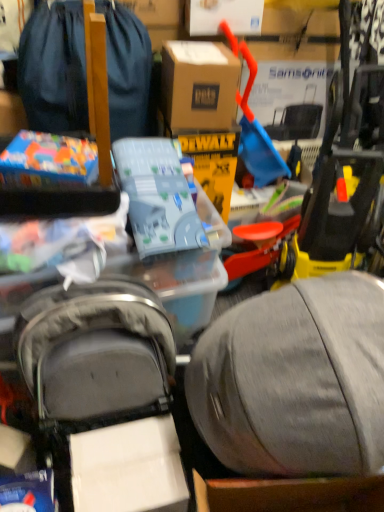
The image size is (384, 512). In order to click on matte black backpack at upper left in this screenshot , I will do `click(54, 68)`.

What do you see at coordinates (198, 85) in the screenshot? I see `brown cardboard box at center` at bounding box center [198, 85].

You are a GUI agent. You are given a task and a screenshot of the screen. Output one action in this format:
    pyautogui.click(x=<x>, y=<y>)
    Task: Click on the matte black backpack at upper left
    The width and height of the screenshot is (384, 512).
    Given the screenshot: What is the action you would take?
    pyautogui.click(x=54, y=68)

You are a GUI agent. You are given a task and a screenshot of the screen. Output one action in this format:
    pyautogui.click(x=<x>, y=<y>)
    Task: Click on the toy to the right of matte plastic toy at upper left, the second toy from the right
    The width and height of the screenshot is (384, 512).
    Given the screenshot: What is the action you would take?
    pyautogui.click(x=157, y=196)

Which object is further away from the camera taking this photo, matte plastic toy at upper left, marked as the first toy in a left-to-right arrangement, or translucent plastic toy at center, which is the second toy in left-to-right order?

matte plastic toy at upper left, marked as the first toy in a left-to-right arrangement.

From a real-world perspective, is matte plastic toy at upper left, the second toy from the right, on translucent plastic toy at center, which is the second toy in left-to-right order?

Indeed, from a real-world perspective, matte plastic toy at upper left, the second toy from the right, stands above translucent plastic toy at center, which is the second toy in left-to-right order.

From the image's perspective, would you say matte black backpack at upper left is shown under brown cardboard box at center?

No.

Does point (39, 11) appear closer or farther from the camera than point (175, 80)?

Clearly, point (39, 11) is more distant from the camera than point (175, 80).

Is matte black backpack at upper left wider than brown cardboard box at center?

Correct, the width of matte black backpack at upper left exceeds that of brown cardboard box at center.

In the image, is matte black backpack at upper left on the left side or the right side of brown cardboard box at center?

matte black backpack at upper left is to the left of brown cardboard box at center.

Can you confirm if translucent plastic toy at center, which appears as the first toy when viewed from the right, is thinner than brown cardboard box at center?

No, translucent plastic toy at center, which appears as the first toy when viewed from the right, is not thinner than brown cardboard box at center.

Which of these two, translucent plastic toy at center, which appears as the first toy when viewed from the right, or brown cardboard box at center, is bigger?

Bigger between the two is translucent plastic toy at center, which appears as the first toy when viewed from the right.

Can you confirm if translucent plastic toy at center, which appears as the first toy when viewed from the right, is taller than brown cardboard box at center?

Indeed, translucent plastic toy at center, which appears as the first toy when viewed from the right, has a greater height compared to brown cardboard box at center.

Considering their positions, is translucent plastic toy at center, which is the second toy in left-to-right order, located in front of or behind brown cardboard box at center?

In the image, translucent plastic toy at center, which is the second toy in left-to-right order, appears in front of brown cardboard box at center.

Is translucent plastic toy at center, which appears as the first toy when viewed from the right, to the left of matte plastic toy at upper left, marked as the first toy in a left-to-right arrangement, from the viewer's perspective?

Incorrect, translucent plastic toy at center, which appears as the first toy when viewed from the right, is not on the left side of matte plastic toy at upper left, marked as the first toy in a left-to-right arrangement.

Would you consider translucent plastic toy at center, which appears as the first toy when viewed from the right, to be distant from matte plastic toy at upper left, the second toy from the right?

No, translucent plastic toy at center, which appears as the first toy when viewed from the right, is in close proximity to matte plastic toy at upper left, the second toy from the right.

From a real-world perspective, is translucent plastic toy at center, which is the second toy in left-to-right order, located higher than matte plastic toy at upper left, marked as the first toy in a left-to-right arrangement?

Actually, translucent plastic toy at center, which is the second toy in left-to-right order, is physically below matte plastic toy at upper left, marked as the first toy in a left-to-right arrangement, in the real world.

Who is shorter, matte plastic toy at upper left, the second toy from the right, or matte black backpack at upper left?

With less height is matte plastic toy at upper left, the second toy from the right.

From a real-world perspective, which is physically above, matte plastic toy at upper left, marked as the first toy in a left-to-right arrangement, or matte black backpack at upper left?

matte black backpack at upper left, from a real-world perspective.

Considering the relative sizes of matte plastic toy at upper left, the second toy from the right, and matte black backpack at upper left in the image provided, is matte plastic toy at upper left, the second toy from the right, wider than matte black backpack at upper left?

In fact, matte plastic toy at upper left, the second toy from the right, might be narrower than matte black backpack at upper left.

From the image's perspective, would you say matte plastic toy at upper left, marked as the first toy in a left-to-right arrangement, is positioned over matte black backpack at upper left?

Actually, matte plastic toy at upper left, marked as the first toy in a left-to-right arrangement, appears below matte black backpack at upper left in the image.

Based on the photo, how distant is matte black backpack at upper left from translucent plastic toy at center, which appears as the first toy when viewed from the right?

The distance of matte black backpack at upper left from translucent plastic toy at center, which appears as the first toy when viewed from the right, is 12.77 inches.

Is translucent plastic toy at center, which is the second toy in left-to-right order, at the back of matte black backpack at upper left?

matte black backpack at upper left does not have its back to translucent plastic toy at center, which is the second toy in left-to-right order.

Which object is further away from the camera, matte black backpack at upper left or translucent plastic toy at center, which is the second toy in left-to-right order?

matte black backpack at upper left is further away from the camera.

From the image's perspective, is matte black backpack at upper left beneath translucent plastic toy at center, which is the second toy in left-to-right order?

No, from the image's perspective, matte black backpack at upper left is not below translucent plastic toy at center, which is the second toy in left-to-right order.

Which object is more forward, brown cardboard box at center or translucent plastic toy at center, which is the second toy in left-to-right order?

translucent plastic toy at center, which is the second toy in left-to-right order, is closer to the camera.

How many degrees apart are the facing directions of brown cardboard box at center and translucent plastic toy at center, which appears as the first toy when viewed from the right?

There is a 8.62-degree angle between the facing directions of brown cardboard box at center and translucent plastic toy at center, which appears as the first toy when viewed from the right.

Is point (162, 90) more distant than point (137, 231)?

Yes, point (162, 90) is farther from viewer.

Is brown cardboard box at center positioned with its back to translucent plastic toy at center, which is the second toy in left-to-right order?

That's not correct — brown cardboard box at center is not looking away from translucent plastic toy at center, which is the second toy in left-to-right order.

Locate an element on the screen. toy lying on the left of translucent plastic toy at center, which is the second toy in left-to-right order is located at coordinates (48, 160).

Find the location of a particular element. The height and width of the screenshot is (512, 384). luggage and bags below the brown cardboard box at center (from a real-world perspective) is located at coordinates (54, 68).

Which object lies further to the anchor point matte plastic toy at upper left, the second toy from the right, matte black backpack at upper left or translucent plastic toy at center, which appears as the first toy when viewed from the right?

Based on the image, matte black backpack at upper left appears to be further to matte plastic toy at upper left, the second toy from the right.

Based on their spatial positions, is matte black backpack at upper left or matte plastic toy at upper left, the second toy from the right, closer to translucent plastic toy at center, which appears as the first toy when viewed from the right?

matte plastic toy at upper left, the second toy from the right, lies closer to translucent plastic toy at center, which appears as the first toy when viewed from the right, than the other object.

Looking at the image, which one is located closer to translucent plastic toy at center, which is the second toy in left-to-right order, matte plastic toy at upper left, marked as the first toy in a left-to-right arrangement, or matte black backpack at upper left?

matte plastic toy at upper left, marked as the first toy in a left-to-right arrangement, is closer to translucent plastic toy at center, which is the second toy in left-to-right order.

From the image, which object appears to be nearer to translucent plastic toy at center, which is the second toy in left-to-right order, brown cardboard box at center or matte black backpack at upper left?

brown cardboard box at center.

Which object lies nearer to the anchor point matte black backpack at upper left, translucent plastic toy at center, which appears as the first toy when viewed from the right, or brown cardboard box at center?

brown cardboard box at center.

From the image, which object appears to be nearer to matte black backpack at upper left, translucent plastic toy at center, which appears as the first toy when viewed from the right, or matte plastic toy at upper left, marked as the first toy in a left-to-right arrangement?

translucent plastic toy at center, which appears as the first toy when viewed from the right, is closer to matte black backpack at upper left.

Looking at this image, which object lies nearer to the anchor point brown cardboard box at center, translucent plastic toy at center, which is the second toy in left-to-right order, or matte plastic toy at upper left, marked as the first toy in a left-to-right arrangement?

Based on the image, translucent plastic toy at center, which is the second toy in left-to-right order, appears to be nearer to brown cardboard box at center.

Looking at the image, which one is located further to brown cardboard box at center, matte black backpack at upper left or matte plastic toy at upper left, marked as the first toy in a left-to-right arrangement?

matte plastic toy at upper left, marked as the first toy in a left-to-right arrangement.

You are a GUI agent. You are given a task and a screenshot of the screen. Output one action in this format:
    pyautogui.click(x=<x>, y=<y>)
    Task: Click on the toy between brown cardboard box at center and translucent plastic toy at center, which is the second toy in left-to-right order, from top to bottom
    This screenshot has width=384, height=512.
    Given the screenshot: What is the action you would take?
    pyautogui.click(x=48, y=160)

The image size is (384, 512). What are the coordinates of `box between matte black backpack at upper left and translucent plastic toy at center, which appears as the first toy when viewed from the right, from top to bottom` in the screenshot? It's located at (198, 85).

The image size is (384, 512). I want to click on toy between matte black backpack at upper left and translucent plastic toy at center, which appears as the first toy when viewed from the right, in the vertical direction, so click(x=48, y=160).

The image size is (384, 512). Identify the location of luggage and bags between matte plastic toy at upper left, marked as the first toy in a left-to-right arrangement, and brown cardboard box at center, in the horizontal direction. (54, 68).